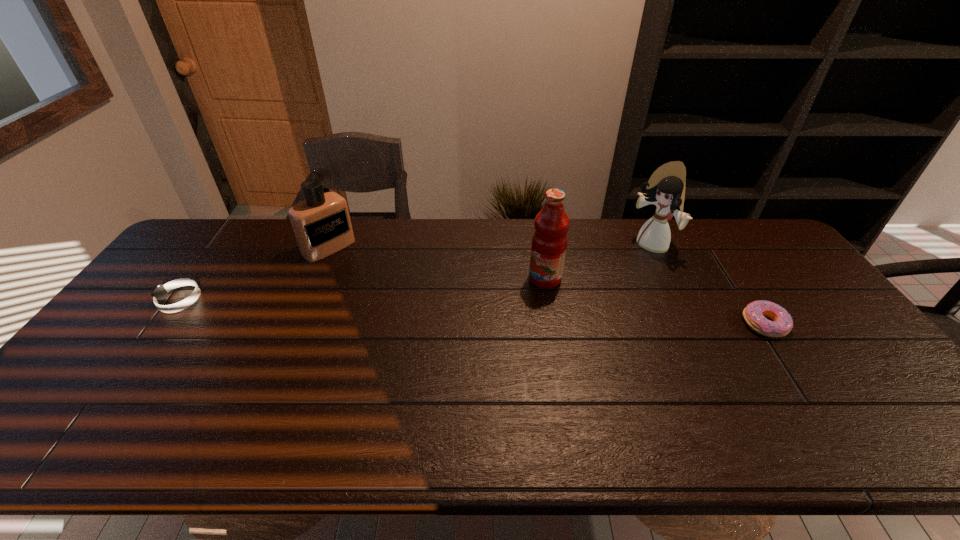
Locate an element on the screen. the leftmost object is located at coordinates (160, 293).

The height and width of the screenshot is (540, 960). In order to click on doughnut in this screenshot , I will do `click(753, 314)`.

Find the location of a particular element. perfume is located at coordinates (321, 223).

The height and width of the screenshot is (540, 960). Find the location of `the fourth object from right to left`. the fourth object from right to left is located at coordinates (321, 223).

The image size is (960, 540). In order to click on the second object from right to left in this screenshot , I will do `click(666, 187)`.

Find the location of `the third object from left to right`. the third object from left to right is located at coordinates (549, 242).

What are the coordinates of `vacant space located 0.080m on the outer surface of the wristband` in the screenshot? It's located at (133, 300).

Where is `vacant space located on the back of the rightmost object`? Image resolution: width=960 pixels, height=540 pixels. vacant space located on the back of the rightmost object is located at coordinates (702, 228).

The image size is (960, 540). What are the coordinates of `free space located on the front label of the second object from left to right` in the screenshot? It's located at (404, 309).

Where is `vacant space located 0.320m on the front label of the second object from left to right`? The image size is (960, 540). vacant space located 0.320m on the front label of the second object from left to right is located at coordinates (402, 308).